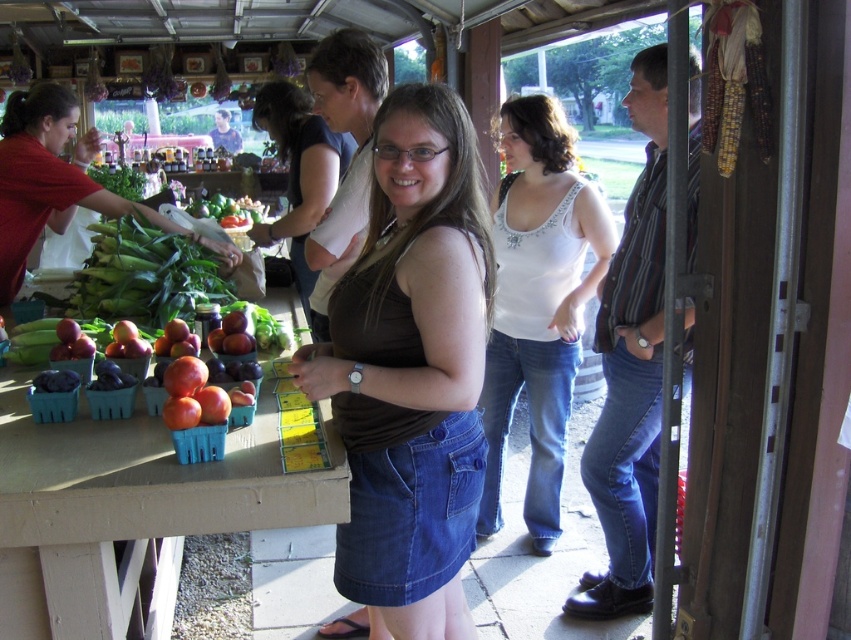
Question: Estimate the real-world distances between objects in this image. Which object is closer to the blue plastic crates at center?

Choices:
 (A) white jersey at center
 (B) green leafy corn at left
 (C) matte black shirt at center

Answer: (B)

Question: Does brown denim skirt at center appear over matte black shirt at center?

Choices:
 (A) no
 (B) yes

Answer: (A)

Question: Which point is farther to the camera?

Choices:
 (A) (465, 449)
 (B) (301, 129)
 (C) (218, 209)

Answer: (C)

Question: Among these objects, which one is nearest to the camera?

Choices:
 (A) brown denim skirt at center
 (B) green leafy vegetables at center

Answer: (A)

Question: Considering the relative positions of white jersey at center and matte black shirt at center in the image provided, where is white jersey at center located with respect to matte black shirt at center?

Choices:
 (A) below
 (B) above

Answer: (A)

Question: Does blue plastic crates at center have a lesser width compared to green leafy corn at left?

Choices:
 (A) no
 (B) yes

Answer: (A)